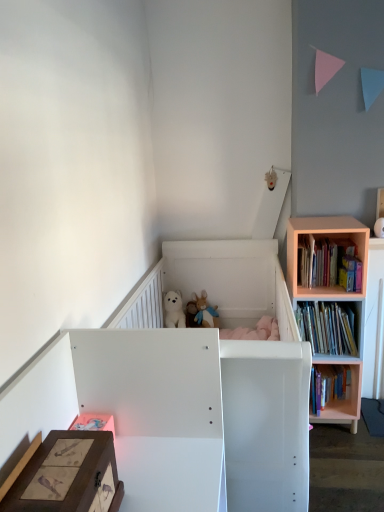
This screenshot has height=512, width=384. What are the coordinates of `free spot above pink wood bookshelf at right (from a real-world perspective)` in the screenshot? It's located at (316, 218).